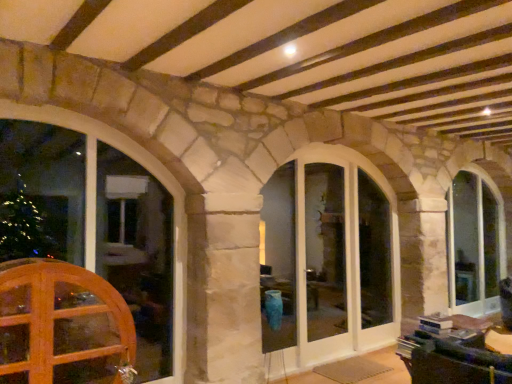
Question: Considering the positions of wooden window at left, acting as the 3th window starting from the right, and white glass door at center in the image, is wooden window at left, acting as the 3th window starting from the right, taller or shorter than white glass door at center?

Choices:
 (A) short
 (B) tall

Answer: (A)

Question: In terms of size, does wooden window at left, which appears as the first window when viewed from the left, appear bigger or smaller than white glass door at center?

Choices:
 (A) small
 (B) big

Answer: (B)

Question: Which object is positioned farthest from the wooden window at left, which appears as the first window when viewed from the left?

Choices:
 (A) clear glass door at center, the second window positioned from the front
 (B) clear glass window at right, the first window viewed from the back
 (C) white glass door at center
 (D) wooden glass door at lower left

Answer: (B)

Question: Estimate the real-world distances between objects in this image. Which object is farther from the white glass door at center?

Choices:
 (A) wooden glass door at lower left
 (B) wooden window at left, which appears as the first window when viewed from the left
 (C) clear glass door at center, arranged as the 2th window when viewed from the back
 (D) clear glass window at right, which is counted as the third window, starting from the front

Answer: (A)